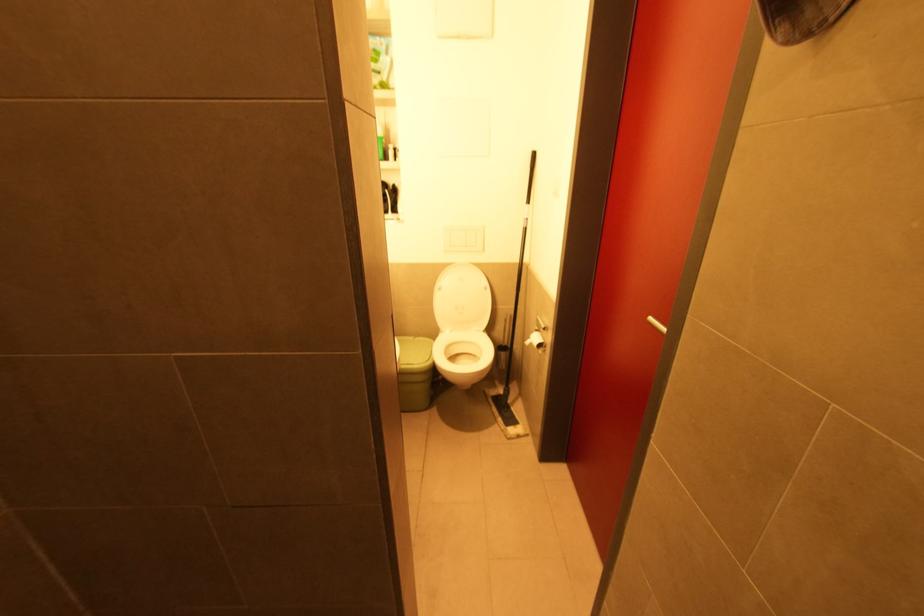
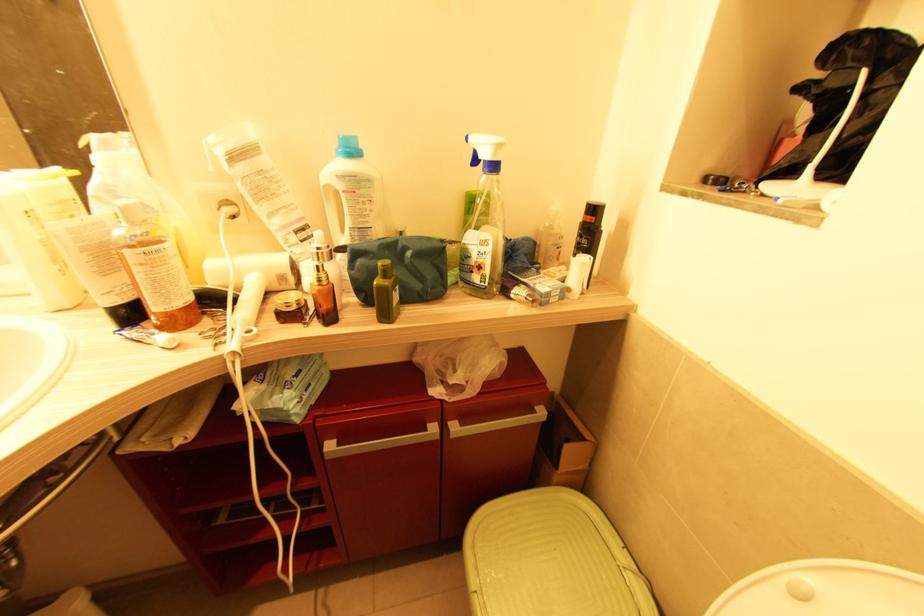
Where in the second image is the point corresponding to (x=417, y=339) from the first image?

(626, 570)